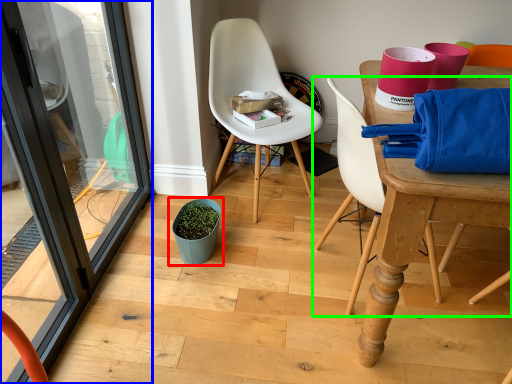
Question: Which object is positioned closest to flowerpot (highlighted by a red box)? Select from screen door (highlighted by a blue box) and chair (highlighted by a green box).

Choices:
 (A) screen door
 (B) chair

Answer: (A)